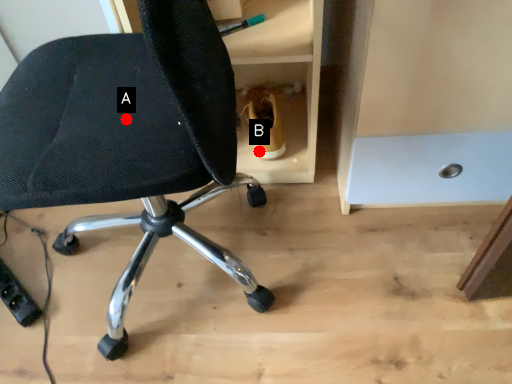
Question: Two points are circled on the image, labeled by A and B beside each circle. Which point is closer to the camera?

Choices:
 (A) A is closer
 (B) B is closer

Answer: (A)